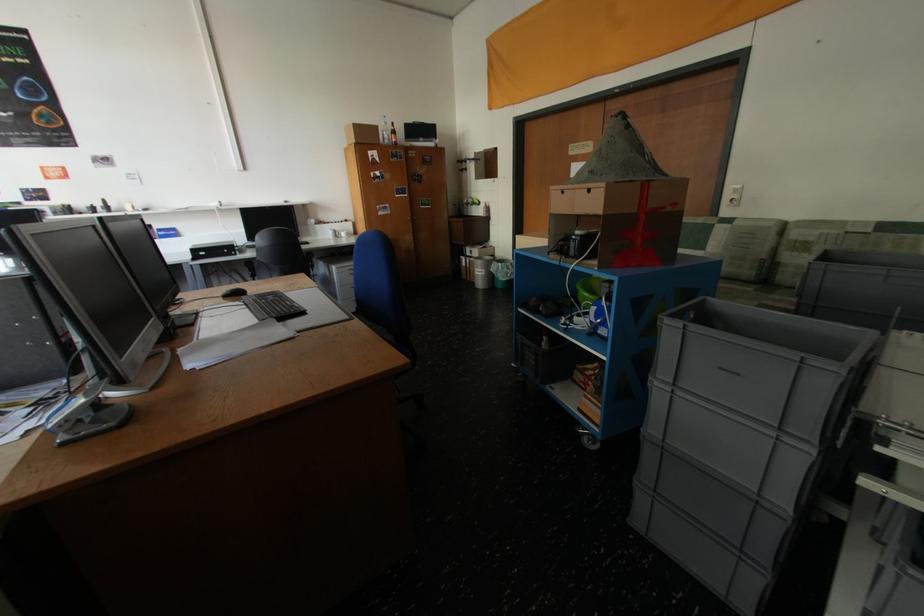
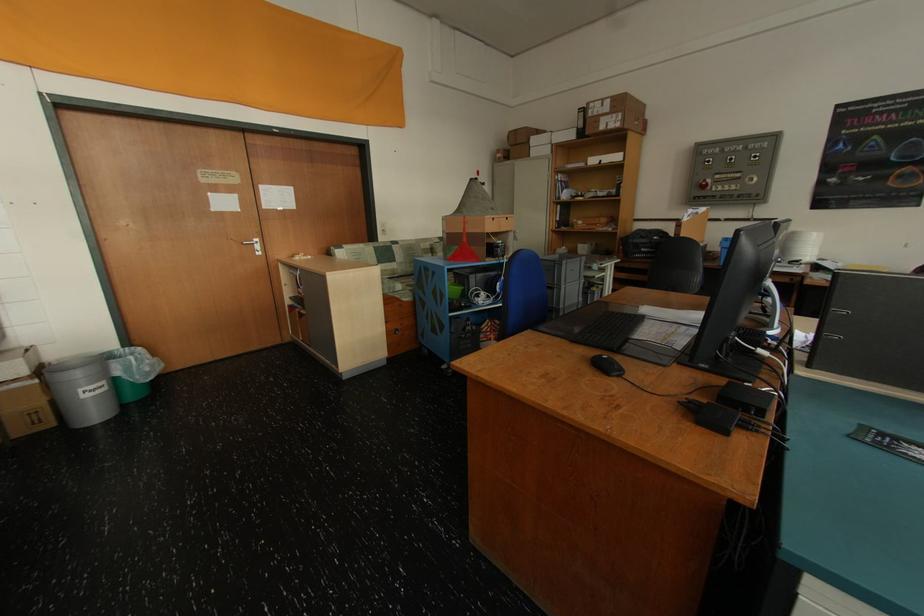
Locate, in the second image, the point that corresponds to point 508,265 in the first image.

(140, 359)